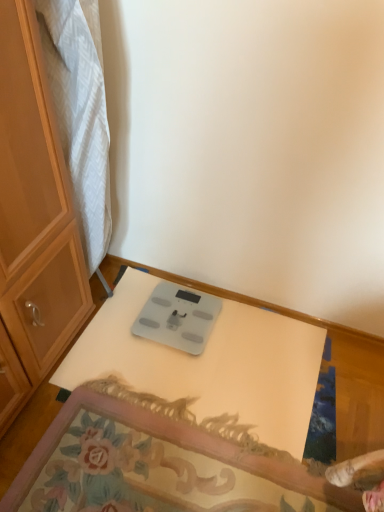
Where is `vacant region above silver metallic scale at center (from a real-world perspective)`? The width and height of the screenshot is (384, 512). vacant region above silver metallic scale at center (from a real-world perspective) is located at coordinates (184, 312).